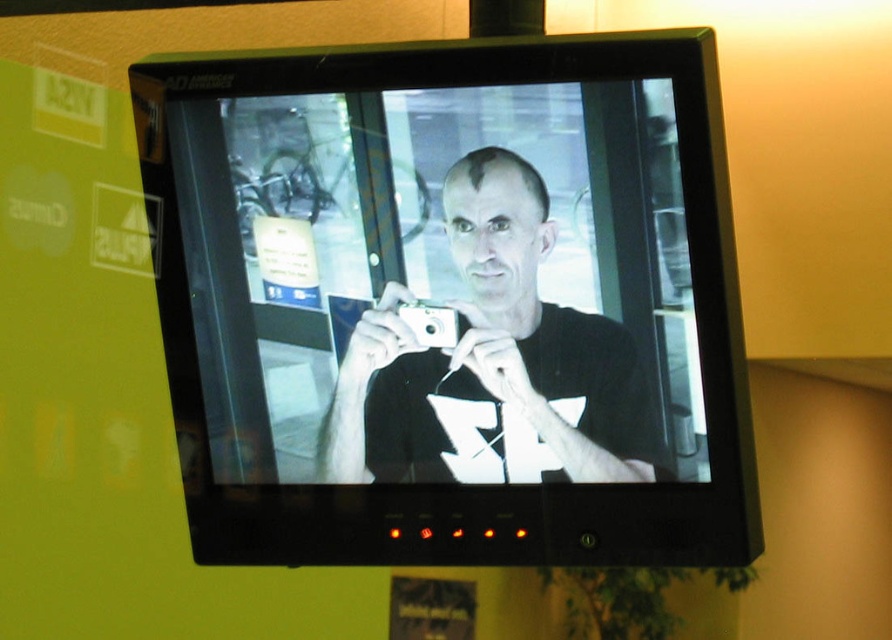
You are setting up a desk and need to place both the black glossy monitor at center and the white glossy camera at center on the same shelf. The shelf has limited vertical space. Which object should you prioritize placing first to ensure both fit vertically?

The black glossy monitor at center is taller than the white glossy camera at center. You should place the black glossy monitor at center first to ensure there is enough space for both items vertically.

You need to place a white glossy camera at center on a shelf that can only hold items up to the width of the black glossy monitor at center. Will the camera fit?

The black glossy monitor at center is wider than the white glossy camera at center, so the camera will fit on the shelf.

You are standing in front of the CRT television screen. There is a point marked at coordinates [711,112] on the screen. If you want to touch this point with a stick that is 1.4 meters long, will the stick reach it?

The point at [711,112] is 1.51 meters away from the viewer. Since the stick is only 1.4 meters long, it will not reach the point.